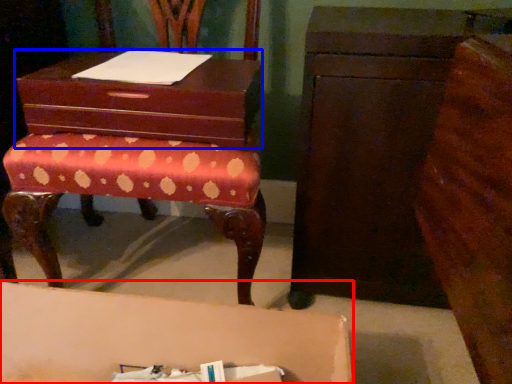
Question: Which object appears closest to the camera in this image, table (highlighted by a red box) or storage box (highlighted by a blue box)?

Choices:
 (A) table
 (B) storage box

Answer: (A)